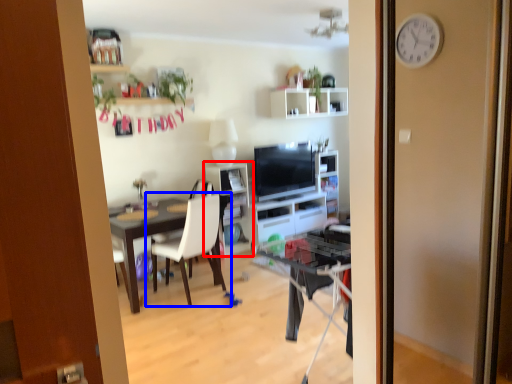
Question: Which of the following is the farthest to the observer, shelf (highlighted by a red box) or chair (highlighted by a blue box)?

Choices:
 (A) shelf
 (B) chair

Answer: (A)